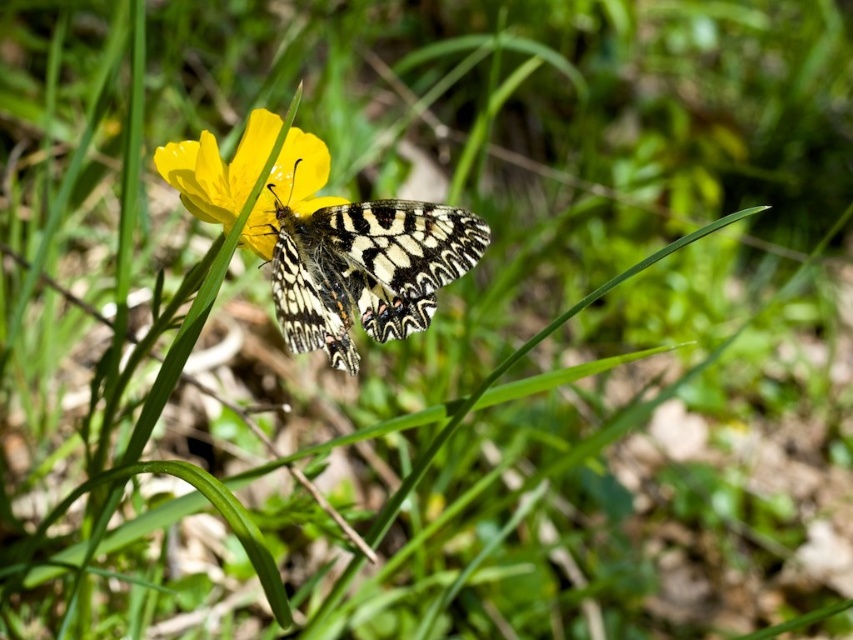
Who is positioned more to the right, patterned wings butterfly at center or yellow matte flower at center?

From the viewer's perspective, patterned wings butterfly at center appears more on the right side.

Who is lower down, patterned wings butterfly at center or yellow matte flower at center?

patterned wings butterfly at center is lower down.

Measure the distance between point (344, 273) and camera.

Point (344, 273) and camera are 1.41 meters apart from each other.

The width and height of the screenshot is (853, 640). Find the location of `patterned wings butterfly at center`. patterned wings butterfly at center is located at coordinates (366, 269).